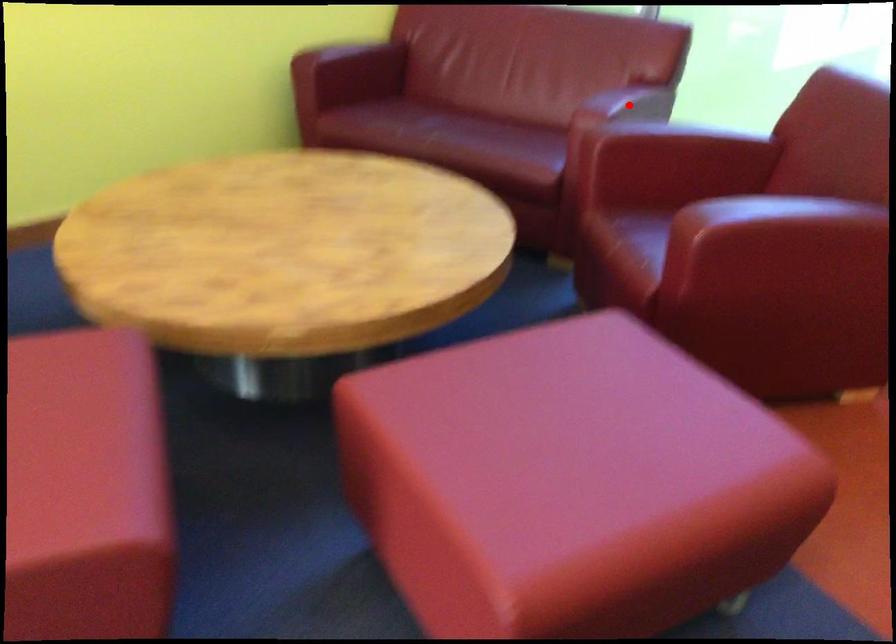
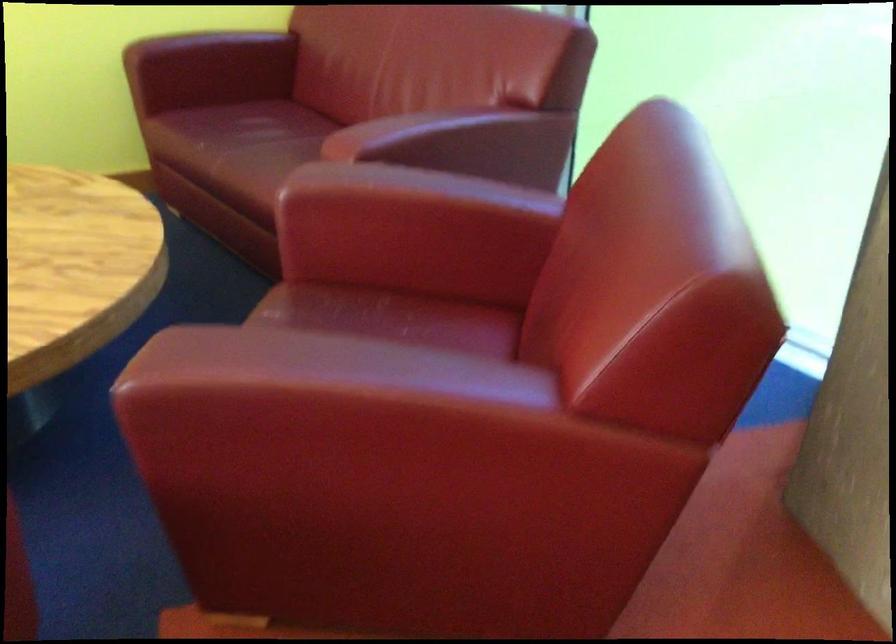
Question: I am providing you with two images of the same scene from different viewpoints. Image1 has a red point marked. In image2, the corresponding 3D location appears at what relative position? Reply with the corresponding letter.

Choices:
 (A) Closer
 (B) Farther

Answer: (A)